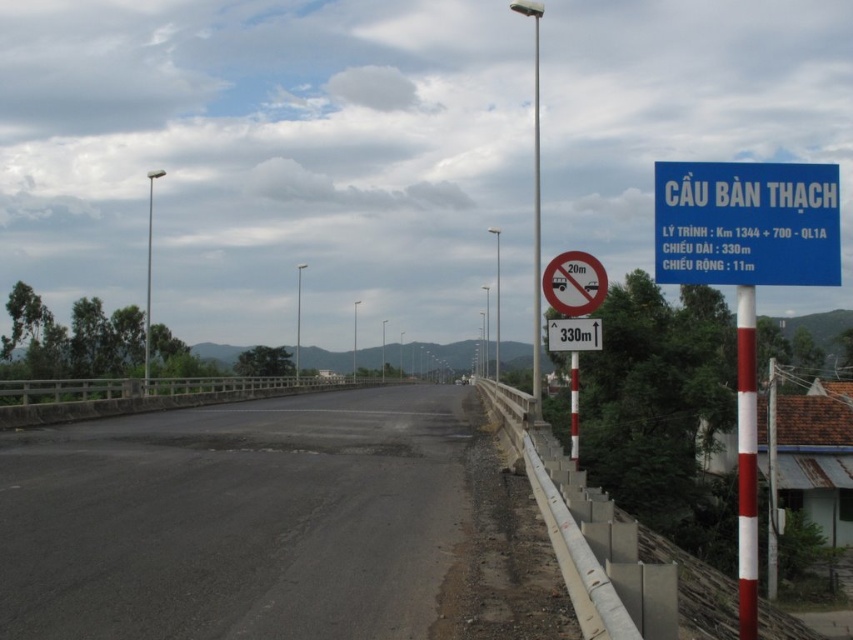
Question: Does white plastic pole at right have a larger size compared to white plastic sign at upper right?

Choices:
 (A) no
 (B) yes

Answer: (B)

Question: Is black asphalt road at center wider than red/white striped pole at right?

Choices:
 (A) yes
 (B) no

Answer: (B)

Question: Which object is farther from the camera taking this photo?

Choices:
 (A) orange matte sign at center
 (B) black asphalt road at center
 (C) blue plastic sign at upper right

Answer: (A)

Question: Is black asphalt road at center to the left of white striped pole at right from the viewer's perspective?

Choices:
 (A) no
 (B) yes

Answer: (B)

Question: Considering the real-world distances, which object is farthest from the red/white striped pole at right?

Choices:
 (A) white plastic sign at upper right
 (B) white striped pole at right
 (C) white plastic pole at right
 (D) black asphalt road at center

Answer: (C)

Question: Estimate the real-world distances between objects in this image. Which object is closer to the white plastic sign at upper right?

Choices:
 (A) black asphalt road at center
 (B) red/white striped pole at right

Answer: (B)